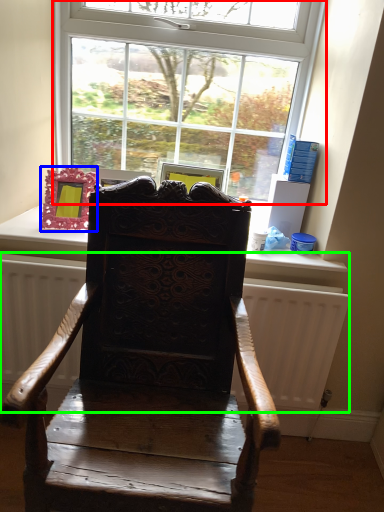
Question: Considering the real-world distances, which object is farthest from window (highlighted by a red box)? picture frame (highlighted by a blue box) or radiator (highlighted by a green box)?

Choices:
 (A) picture frame
 (B) radiator

Answer: (B)